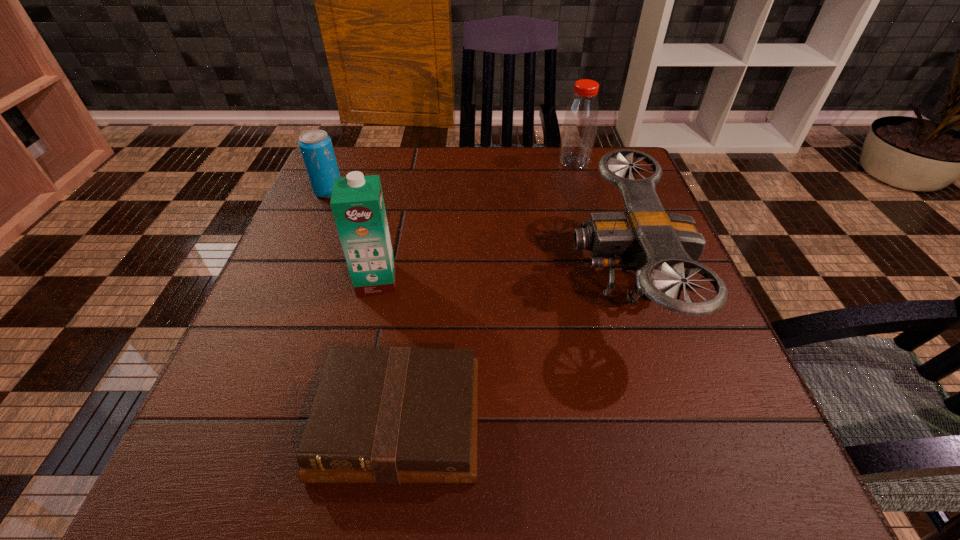
The height and width of the screenshot is (540, 960). I want to click on vacant area located on the front-facing side of the third tallest object, so click(x=451, y=279).

Identify the location of blank area located 0.330m on the front of the fourth nearest object. (282, 300).

The image size is (960, 540). I want to click on bottle at the far edge, so click(x=581, y=118).

You are a GUI agent. You are given a task and a screenshot of the screen. Output one action in this format:
    pyautogui.click(x=<x>, y=<y>)
    Task: Click on the soda can that is at the far edge
    The image size is (960, 540).
    Given the screenshot: What is the action you would take?
    pyautogui.click(x=316, y=147)

This screenshot has width=960, height=540. What are the coordinates of `object that is at the near edge` in the screenshot? It's located at (395, 415).

In order to click on object present at the left edge in this screenshot , I will do `click(316, 147)`.

Identify the location of bottle present at the right edge. Image resolution: width=960 pixels, height=540 pixels. (581, 118).

You are a GUI agent. You are given a task and a screenshot of the screen. Output one action in this format:
    pyautogui.click(x=<x>, y=<y>)
    Task: Click on the drone positioned at the right edge
    The image size is (960, 540).
    Given the screenshot: What is the action you would take?
    pyautogui.click(x=646, y=239)

Where is `object present at the far left corner`? The width and height of the screenshot is (960, 540). object present at the far left corner is located at coordinates (316, 147).

Locate an element on the screen. Image resolution: width=960 pixels, height=540 pixels. object present at the far right corner is located at coordinates (581, 118).